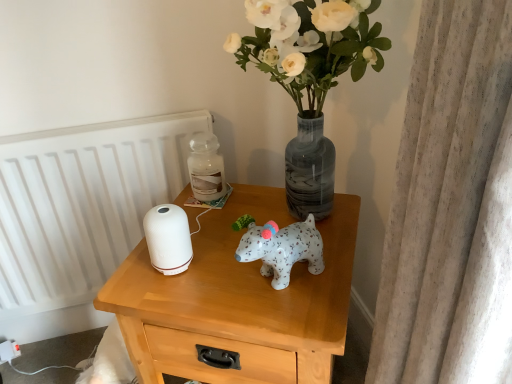
Question: Would you say translucent glass jar at upper center is inside or outside white glossy radiator at left?

Choices:
 (A) inside
 (B) outside

Answer: (B)

Question: Is translucent glass jar at upper center to the left or to the right of white glossy radiator at left in the image?

Choices:
 (A) left
 (B) right

Answer: (B)

Question: Estimate the real-world distances between objects in this image. Which object is closer to the white matte nightstand at center?

Choices:
 (A) white glossy radiator at left
 (B) white matte vase at upper center
 (C) translucent glass jar at upper center

Answer: (C)

Question: Based on their relative distances, which object is farther from the translucent glass jar at upper center?

Choices:
 (A) white glossy radiator at left
 (B) white matte vase at upper center
 (C) white matte nightstand at center

Answer: (A)